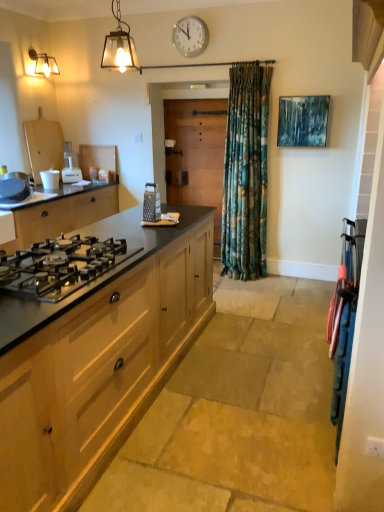
Question: Is silver metallic grater at center, the second appliance when ordered from right to left, not close to matte glass lantern at upper left?

Choices:
 (A) no
 (B) yes

Answer: (B)

Question: Does silver metallic grater at center, the 2th appliance from the bottom, appear on the right side of matte glass lantern at upper left?

Choices:
 (A) yes
 (B) no

Answer: (A)

Question: Is silver metallic grater at center, arranged as the second appliance when viewed from the front, further to camera compared to matte glass lantern at upper left?

Choices:
 (A) no
 (B) yes

Answer: (B)

Question: Does silver metallic grater at center, placed as the 4th appliance when sorted from left to right, touch matte glass lantern at upper left?

Choices:
 (A) no
 (B) yes

Answer: (A)

Question: Does silver metallic grater at center, the second appliance when ordered from right to left, appear on the left side of matte glass lantern at upper left?

Choices:
 (A) no
 (B) yes

Answer: (A)

Question: Is point (195, 155) closer or farther from the camera than point (44, 410)?

Choices:
 (A) closer
 (B) farther

Answer: (B)

Question: Considering the positions of wooden screen door at center and light wood/texture cabinet at left, which appears as the 2th cabinetry when viewed from the back, in the image, is wooden screen door at center bigger or smaller than light wood/texture cabinet at left, which appears as the 2th cabinetry when viewed from the back,?

Choices:
 (A) small
 (B) big

Answer: (A)

Question: From a real-world perspective, is wooden screen door at center positioned above or below light wood/texture cabinet at left, which is counted as the 1th cabinetry, starting from the front?

Choices:
 (A) above
 (B) below

Answer: (A)

Question: From their relative heights in the image, would you say wooden screen door at center is taller or shorter than light wood/texture cabinet at left, which appears as the 2th cabinetry when viewed from the left?

Choices:
 (A) short
 (B) tall

Answer: (B)

Question: From the image's perspective, relative to matte glass lantern at upper left, is white plastic clock at upper center above or below?

Choices:
 (A) below
 (B) above

Answer: (B)

Question: Considering the positions of point (201, 20) and point (135, 52), is point (201, 20) closer or farther from the camera than point (135, 52)?

Choices:
 (A) farther
 (B) closer

Answer: (B)

Question: From their relative heights in the image, would you say white plastic clock at upper center is taller or shorter than matte glass lantern at upper left?

Choices:
 (A) tall
 (B) short

Answer: (B)

Question: Would you say white plastic clock at upper center is to the left or to the right of matte glass lantern at upper left in the picture?

Choices:
 (A) right
 (B) left

Answer: (A)

Question: From the image's perspective, relative to white matte cup at left, arranged as the second appliance when viewed from the back, is matte glass lantern at upper left above or below?

Choices:
 (A) below
 (B) above

Answer: (B)

Question: In terms of size, does matte glass lantern at upper left appear bigger or smaller than white matte cup at left, placed as the second appliance when sorted from left to right?

Choices:
 (A) big
 (B) small

Answer: (A)